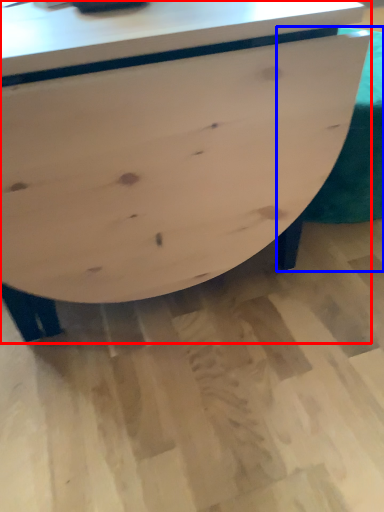
Question: Among these objects, which one is nearest to the camera, table (highlighted by a red box) or swivel chair (highlighted by a blue box)?

Choices:
 (A) table
 (B) swivel chair

Answer: (A)